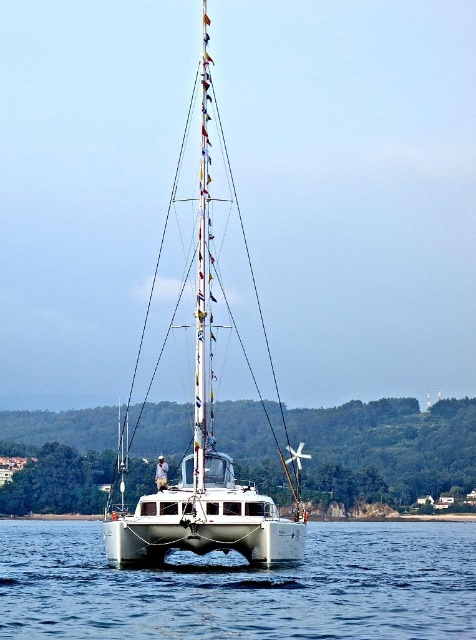
Which is below, clear blue water at center or white glossy sailboat at center?

clear blue water at center is lower down.

Between point (456, 568) and point (231, 467), which one is positioned behind?

The point (456, 568) is more distant.

The width and height of the screenshot is (476, 640). Find the location of `clear blue water at center`. clear blue water at center is located at coordinates (243, 588).